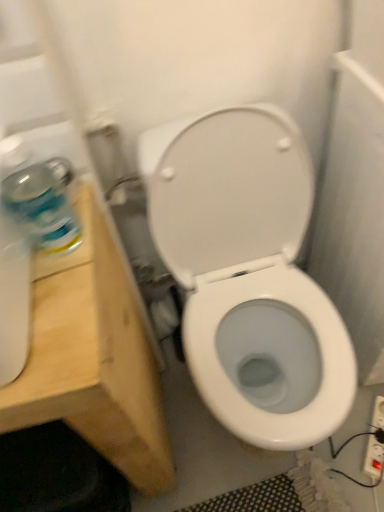
Question: Is point (377, 400) closer or farther from the camera than point (56, 344)?

Choices:
 (A) closer
 (B) farther

Answer: (B)

Question: Is white plastic electrical outlet at lower right taller or shorter than light wood vanity at left?

Choices:
 (A) tall
 (B) short

Answer: (B)

Question: Considering the real-world distances, which object is closest to the white glossy toilet at center?

Choices:
 (A) white plastic electrical outlet at lower right
 (B) clear plastic bottle at left
 (C) light wood vanity at left

Answer: (C)

Question: Which object is the closest to the white plastic electrical outlet at lower right?

Choices:
 (A) light wood vanity at left
 (B) white glossy toilet at center
 (C) clear plastic bottle at left

Answer: (B)